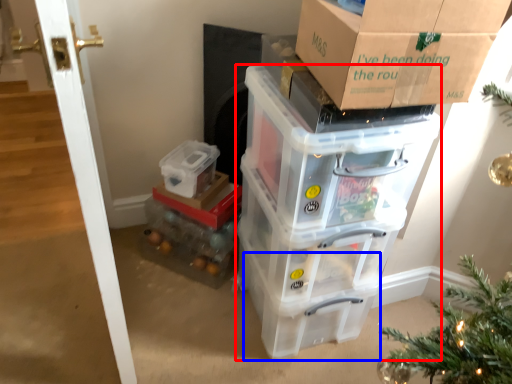
Question: Which object is further to the camera taking this photo, storage box (highlighted by a red box) or storage box (highlighted by a blue box)?

Choices:
 (A) storage box
 (B) storage box

Answer: (B)